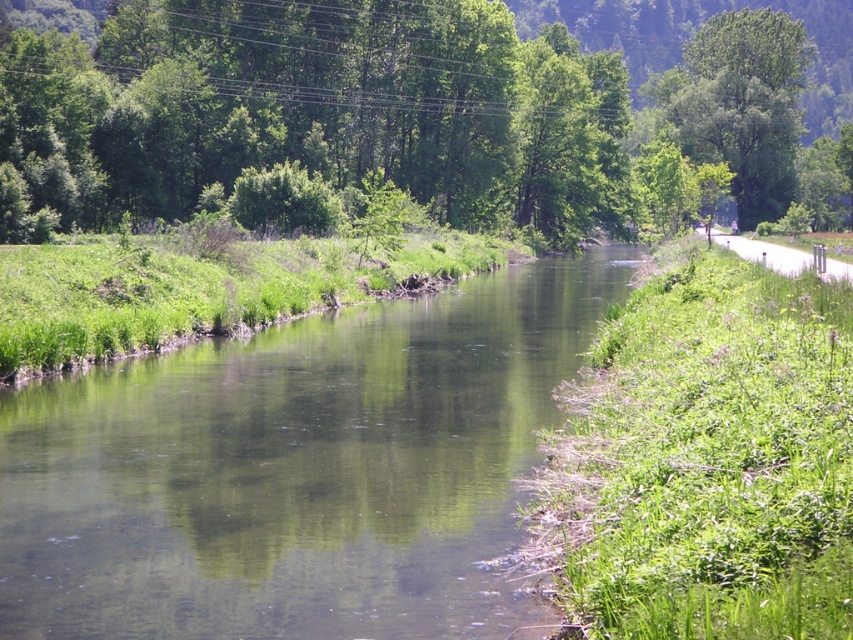
Question: Is green leafy tree at upper center further to camera compared to green leafy tree at upper right?

Choices:
 (A) yes
 (B) no

Answer: (B)

Question: Which object is farther from the camera taking this photo?

Choices:
 (A) green leafy tree at upper center
 (B) green leafy tree at upper right
 (C) green water at center

Answer: (B)

Question: Which point is closer to the camera taking this photo?

Choices:
 (A) (782, 195)
 (B) (80, 602)

Answer: (B)

Question: Based on their relative distances, which object is farther from the green water at center?

Choices:
 (A) green leafy tree at upper right
 (B) green leafy tree at upper center

Answer: (A)

Question: Is green leafy tree at upper center thinner than green leafy tree at upper right?

Choices:
 (A) yes
 (B) no

Answer: (B)

Question: Can you confirm if green leafy tree at upper center is positioned to the left of green leafy tree at upper right?

Choices:
 (A) no
 (B) yes

Answer: (B)